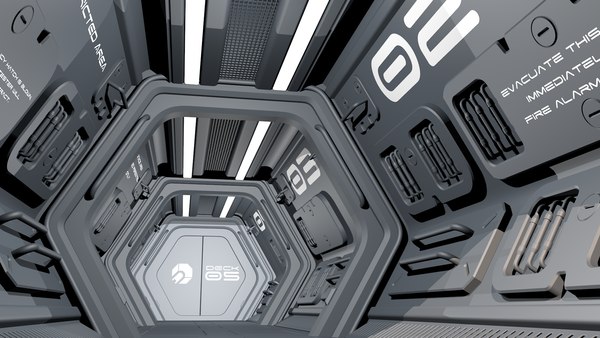
Identify the location of lights. (288, 67), (189, 26).